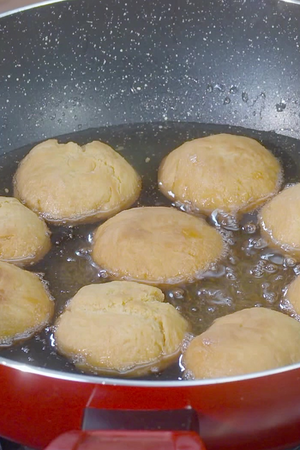
Where is `red metal pan`? The height and width of the screenshot is (450, 300). red metal pan is located at coordinates (38, 408).